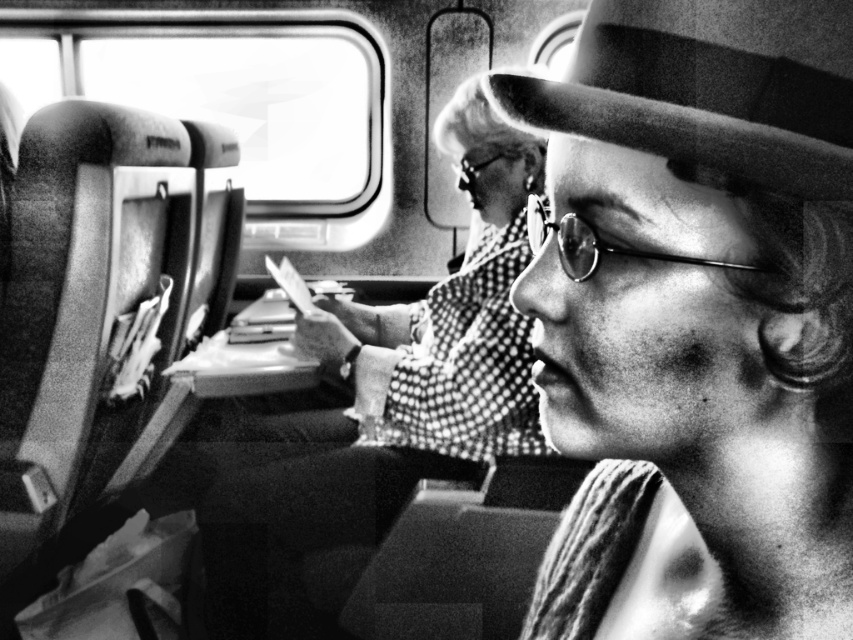
Question: Does striped fabric hat at center lie in front of felt fedora at center?

Choices:
 (A) yes
 (B) no

Answer: (A)

Question: Based on their relative distances, which object is farther from the metallic reflective goggles at upper center?

Choices:
 (A) striped fabric hat at center
 (B) felt fedora at center

Answer: (B)

Question: Considering the relative positions of felt fedora at center and metallic reflective goggles at upper center in the image provided, where is felt fedora at center located with respect to metallic reflective goggles at upper center?

Choices:
 (A) left
 (B) right

Answer: (B)

Question: Observing the image, what is the correct spatial positioning of felt fedora at center in reference to metallic reflective goggles at upper center?

Choices:
 (A) right
 (B) left

Answer: (A)

Question: Considering the real-world distances, which object is closest to the striped fabric hat at center?

Choices:
 (A) felt fedora at center
 (B) metallic reflective goggles at upper center

Answer: (A)

Question: Which point is farther to the camera?

Choices:
 (A) 457,177
 (B) 778,38

Answer: (A)